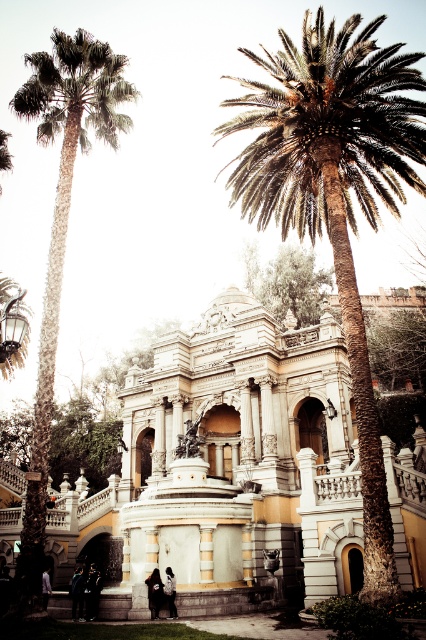
You are a tourist standing in front of the monument and see the green leafy tree at upper center and the dark blue jeans at lower center. Which object is higher in the image?

The green leafy tree at upper center is above the dark blue jeans at lower center, so it is higher in the image.

You are a visitor at this historical monument and want to take a photo of both the green leafy tree at upper center and the dark blue jeans at lower center in the same frame. Which object should you focus on first to ensure both are in the shot?

You should focus on the green leafy tree at upper center first because it is larger than the dark blue jeans at lower center, so it will require more space in the frame.